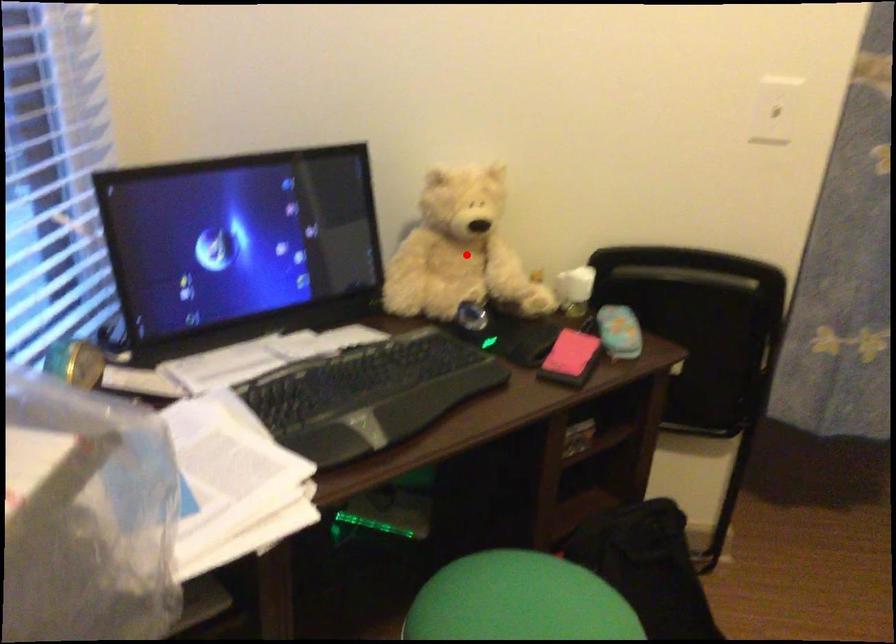
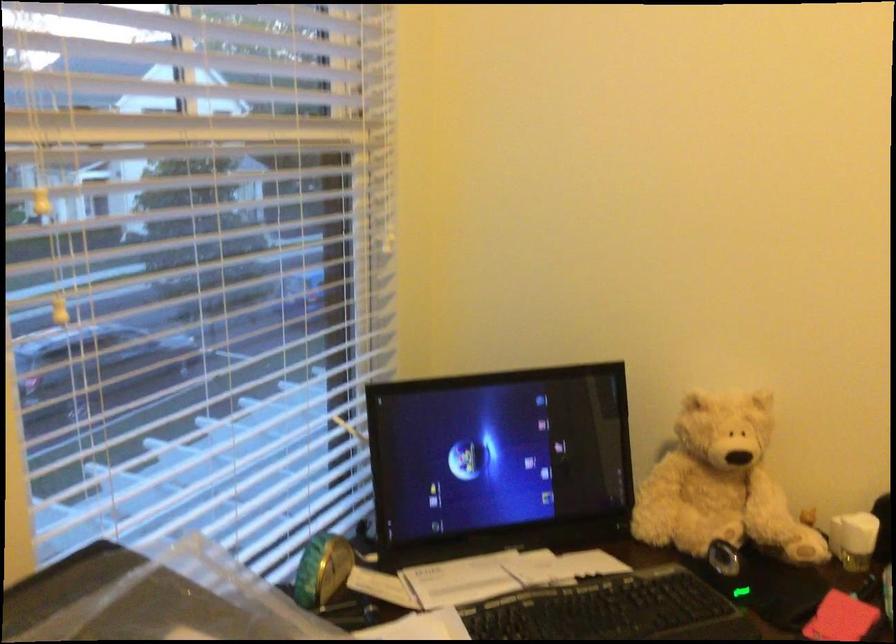
Where in the second image is the point corresponding to the highlighted location from the first image?

(720, 484)